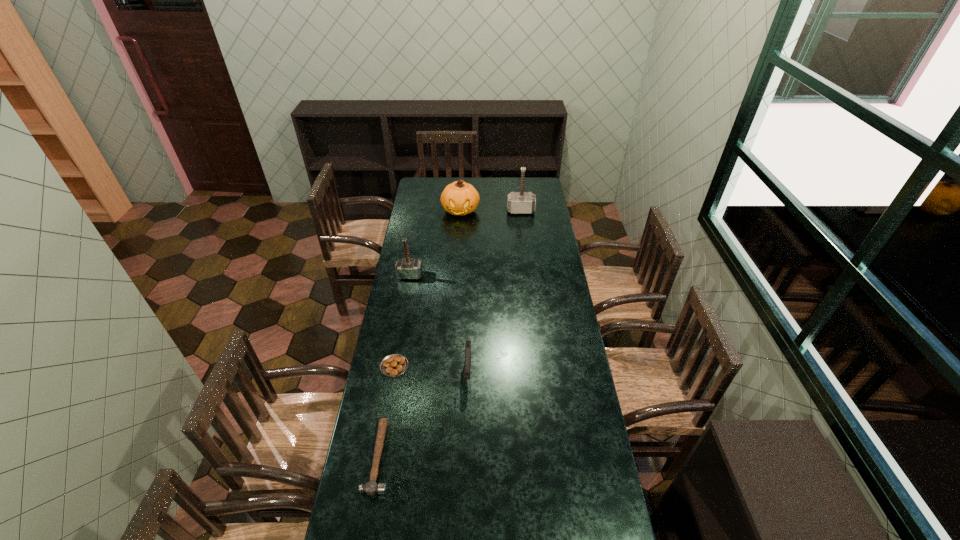
The height and width of the screenshot is (540, 960). What are the coordinates of `vacant space located 0.370m on the right of the fourth nearest object` in the screenshot? It's located at (496, 275).

What are the coordinates of `free point located 0.260m on the front face of the pumpkin` in the screenshot? It's located at (458, 249).

I want to click on vacant area located 0.360m at the barrel of the pistol, so click(466, 484).

The image size is (960, 540). I want to click on vacant space positioned 0.190m on the striking face of the nearest hammer, so click(x=447, y=457).

This screenshot has height=540, width=960. What are the coordinates of `vacant space positioned on the back of the pastry` in the screenshot? It's located at (400, 335).

This screenshot has height=540, width=960. I want to click on pastry at the left edge, so click(x=393, y=365).

The height and width of the screenshot is (540, 960). What are the coordinates of `object at the right edge` in the screenshot? It's located at (521, 202).

You are a GUI agent. You are given a task and a screenshot of the screen. Output one action in this format:
    pyautogui.click(x=<x>, y=<y>)
    Task: Click on the vacant space at the left edge
    This screenshot has height=540, width=960.
    Given the screenshot: What is the action you would take?
    pyautogui.click(x=419, y=348)

In the image, there is a desktop. What are the coordinates of `vacant space at the right edge` in the screenshot? It's located at (544, 328).

At what (x,y) coordinates should I click in order to perform the action: click on vacant region at the far left corner. Please return your answer as a coordinate pair (x, y). This screenshot has width=960, height=540. Looking at the image, I should click on (437, 180).